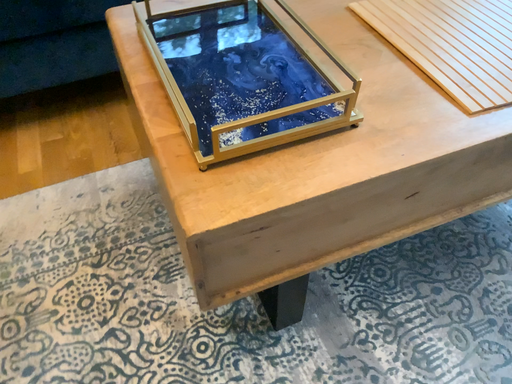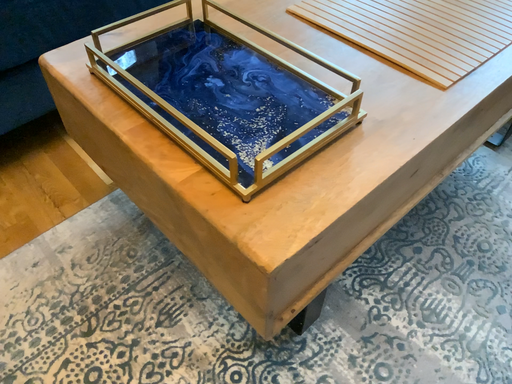
Question: How did the camera likely rotate when shooting the video?

Choices:
 (A) rotated right
 (B) rotated left

Answer: (A)